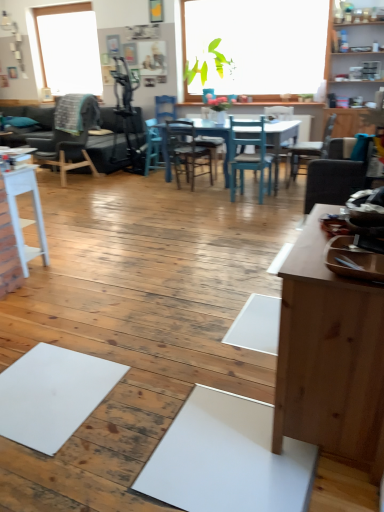
Question: Does blue wood chair at center, marked as the 2th chair in a left-to-right arrangement, have a greater width compared to teal wood chair at center, placed as the third chair when sorted from right to left?

Choices:
 (A) yes
 (B) no

Answer: (B)

Question: Is blue wood chair at center, marked as the 2th chair in a left-to-right arrangement, looking in the opposite direction of teal wood chair at center, the fourth chair from the left?

Choices:
 (A) no
 (B) yes

Answer: (A)

Question: From the image's perspective, is blue wood chair at center, which is the fifth chair in right-to-left order, below teal wood chair at center, the fourth chair from the left?

Choices:
 (A) yes
 (B) no

Answer: (B)

Question: Considering the relative positions of blue wood chair at center, which is the fifth chair in right-to-left order, and teal wood chair at center, placed as the third chair when sorted from right to left, in the image provided, is blue wood chair at center, which is the fifth chair in right-to-left order, behind teal wood chair at center, placed as the third chair when sorted from right to left,?

Choices:
 (A) no
 (B) yes

Answer: (B)

Question: Is blue wood chair at center, marked as the 2th chair in a left-to-right arrangement, outside teal wood chair at center, the fourth chair from the left?

Choices:
 (A) no
 (B) yes

Answer: (B)

Question: From a real-world perspective, is wooden cabinet at upper right physically located above or below white matte table at left?

Choices:
 (A) below
 (B) above

Answer: (B)

Question: In terms of size, does wooden cabinet at upper right appear bigger or smaller than white matte table at left?

Choices:
 (A) small
 (B) big

Answer: (B)

Question: Considering the relative positions of wooden cabinet at upper right and white matte table at left in the image provided, is wooden cabinet at upper right to the left or to the right of white matte table at left?

Choices:
 (A) right
 (B) left

Answer: (A)

Question: Considering the positions of wooden cabinet at upper right and white matte table at left in the image, is wooden cabinet at upper right wider or thinner than white matte table at left?

Choices:
 (A) thin
 (B) wide

Answer: (A)

Question: Looking at their shapes, would you say suede-like gray chair at right, acting as the 5th chair starting from the left, is wider or thinner than white matte table at left?

Choices:
 (A) thin
 (B) wide

Answer: (B)

Question: Would you say suede-like gray chair at right, arranged as the second chair when viewed from the right, is to the left or to the right of white matte table at left in the picture?

Choices:
 (A) left
 (B) right

Answer: (B)

Question: Considering the positions of point (337, 198) and point (26, 176), is point (337, 198) closer or farther from the camera than point (26, 176)?

Choices:
 (A) closer
 (B) farther

Answer: (B)

Question: In terms of height, does suede-like gray chair at right, acting as the 5th chair starting from the left, look taller or shorter compared to white matte table at left?

Choices:
 (A) short
 (B) tall

Answer: (A)

Question: From a real-world perspective, relative to wooden chair at center, which ranks as the third chair in left-to-right order, is dark brown wooden chair at left, which is the first chair in left-to-right order, vertically above or below?

Choices:
 (A) below
 (B) above

Answer: (B)

Question: Based on their positions, is dark brown wooden chair at left, which is the first chair in left-to-right order, located to the left or right of wooden chair at center, which ranks as the third chair in left-to-right order?

Choices:
 (A) left
 (B) right

Answer: (A)